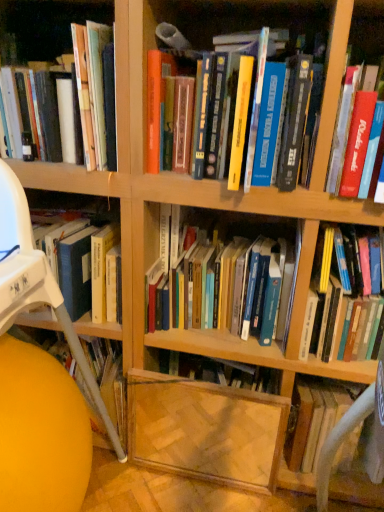
Question: Is the position of wooden bookshelf at left, which is the 2th shelf in right-to-left order, more distant than that of matte yellow ball at lower left?

Choices:
 (A) yes
 (B) no

Answer: (B)

Question: Is wooden bookshelf at left, which is the 2th shelf in right-to-left order, thinner than matte yellow ball at lower left?

Choices:
 (A) no
 (B) yes

Answer: (A)

Question: Can you confirm if wooden bookshelf at left, which ranks as the first shelf in left-to-right order, is shorter than matte yellow ball at lower left?

Choices:
 (A) no
 (B) yes

Answer: (A)

Question: Is wooden bookshelf at left, which is the 2th shelf in right-to-left order, taller than matte yellow ball at lower left?

Choices:
 (A) no
 (B) yes

Answer: (B)

Question: Is wooden bookshelf at left, which is the 2th shelf in right-to-left order, not inside matte yellow ball at lower left?

Choices:
 (A) yes
 (B) no

Answer: (B)

Question: Considering their positions, is white fabric computer chair at right located in front of or behind hardcover book at center right, the 1th book when ordered from right to left?

Choices:
 (A) behind
 (B) front

Answer: (A)

Question: Is point (372, 402) closer or farther from the camera than point (339, 231)?

Choices:
 (A) closer
 (B) farther

Answer: (A)

Question: From a real-world perspective, is white fabric computer chair at right physically located above or below hardcover book at center right, the 1th book when ordered from right to left?

Choices:
 (A) above
 (B) below

Answer: (B)

Question: Do you think white fabric computer chair at right is within hardcover book at center right, which is counted as the 5th book, starting from the left, or outside of it?

Choices:
 (A) inside
 (B) outside

Answer: (B)

Question: Is wooden bookshelf at left, which is the 2th shelf in right-to-left order, inside or outside of transparent glass shelf at lower center, the second shelf viewed from the left?

Choices:
 (A) outside
 (B) inside

Answer: (A)

Question: Is wooden bookshelf at left, which ranks as the first shelf in left-to-right order, in front of or behind transparent glass shelf at lower center, positioned as the 1th shelf in right-to-left order, in the image?

Choices:
 (A) front
 (B) behind

Answer: (A)

Question: Would you say wooden bookshelf at left, which is the 2th shelf in right-to-left order, is to the left or to the right of transparent glass shelf at lower center, positioned as the 1th shelf in right-to-left order, in the picture?

Choices:
 (A) right
 (B) left

Answer: (B)

Question: Is wooden bookshelf at left, which ranks as the first shelf in left-to-right order, taller or shorter than transparent glass shelf at lower center, positioned as the 1th shelf in right-to-left order?

Choices:
 (A) tall
 (B) short

Answer: (A)

Question: In the image, is matte yellow ball at lower left positioned in front of or behind white fabric computer chair at right?

Choices:
 (A) behind
 (B) front

Answer: (B)

Question: In terms of size, does matte yellow ball at lower left appear bigger or smaller than white fabric computer chair at right?

Choices:
 (A) small
 (B) big

Answer: (B)